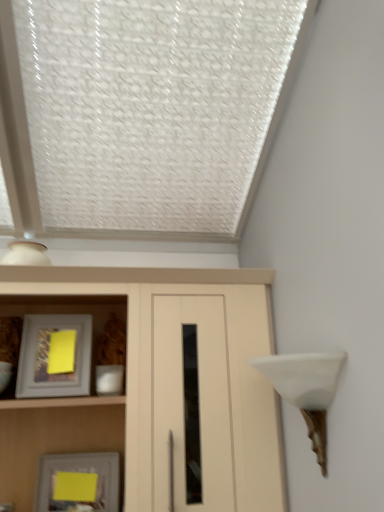
Question: Is yellow paper at lower left, positioned as the 2th picture frame in top-to-bottom order, facing towards matte gray picture frame at left, the first picture frame viewed from the top?

Choices:
 (A) no
 (B) yes

Answer: (A)

Question: Is yellow paper at lower left, positioned as the 2th picture frame in top-to-bottom order, behind matte gray picture frame at left, the first picture frame viewed from the top?

Choices:
 (A) yes
 (B) no

Answer: (A)

Question: Can you confirm if yellow paper at lower left, acting as the first picture frame starting from the bottom, is bigger than matte gray picture frame at left, the 2th picture frame in the bottom-to-top sequence?

Choices:
 (A) no
 (B) yes

Answer: (A)

Question: Is yellow paper at lower left, positioned as the 2th picture frame in top-to-bottom order, thinner than matte gray picture frame at left, the 2th picture frame in the bottom-to-top sequence?

Choices:
 (A) yes
 (B) no

Answer: (A)

Question: Can we say yellow paper at lower left, acting as the first picture frame starting from the bottom, lies outside matte gray picture frame at left, the first picture frame viewed from the top?

Choices:
 (A) no
 (B) yes

Answer: (B)

Question: From a real-world perspective, is yellow paper at lower left, positioned as the 2th picture frame in top-to-bottom order, physically located above or below matte wood cupboard at center?

Choices:
 (A) above
 (B) below

Answer: (B)

Question: Considering the positions of point (64, 473) and point (150, 272), is point (64, 473) closer or farther from the camera than point (150, 272)?

Choices:
 (A) farther
 (B) closer

Answer: (A)

Question: Is yellow paper at lower left, positioned as the 2th picture frame in top-to-bottom order, spatially inside matte wood cupboard at center, or outside of it?

Choices:
 (A) outside
 (B) inside

Answer: (B)

Question: In terms of height, does yellow paper at lower left, acting as the first picture frame starting from the bottom, look taller or shorter compared to matte wood cupboard at center?

Choices:
 (A) tall
 (B) short

Answer: (B)

Question: From the image's perspective, is white matte table lamp at right positioned above or below matte gray picture frame at left, the 2th picture frame in the bottom-to-top sequence?

Choices:
 (A) above
 (B) below

Answer: (B)

Question: Which is correct: white matte table lamp at right is inside matte gray picture frame at left, the first picture frame viewed from the top, or outside of it?

Choices:
 (A) outside
 (B) inside

Answer: (A)

Question: Considering the positions of white matte table lamp at right and matte gray picture frame at left, the 2th picture frame in the bottom-to-top sequence, in the image, is white matte table lamp at right taller or shorter than matte gray picture frame at left, the 2th picture frame in the bottom-to-top sequence,?

Choices:
 (A) short
 (B) tall

Answer: (B)

Question: In terms of width, does white matte table lamp at right look wider or thinner when compared to matte gray picture frame at left, the first picture frame viewed from the top?

Choices:
 (A) thin
 (B) wide

Answer: (B)

Question: Is white matte table lamp at right in front of or behind matte wood cupboard at center in the image?

Choices:
 (A) front
 (B) behind

Answer: (A)

Question: Is point (322, 389) positioned closer to the camera than point (115, 287)?

Choices:
 (A) closer
 (B) farther

Answer: (A)